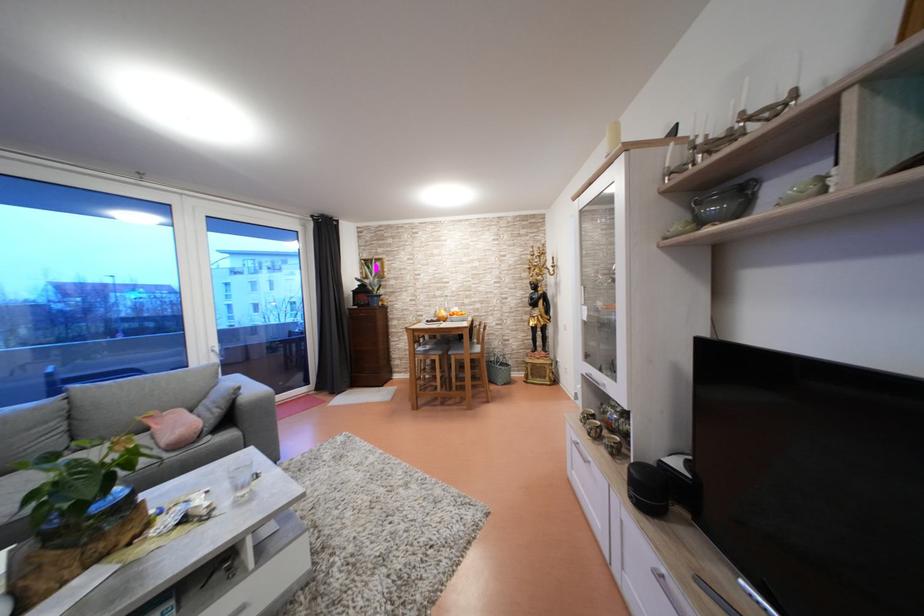
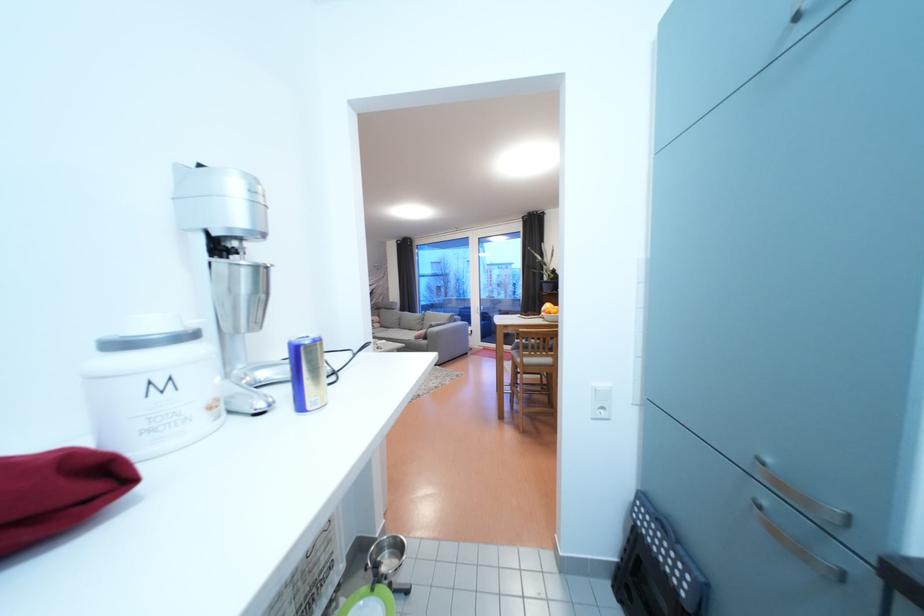
Question: I am providing you with two images of the same scene from different viewpoints. Which of the following objects are not visible in image2?

Choices:
 (A) small ceramic cup
 (B) white light switch
 (C) metal scoop
 (D) yellow shampoo bottle

Answer: (A)